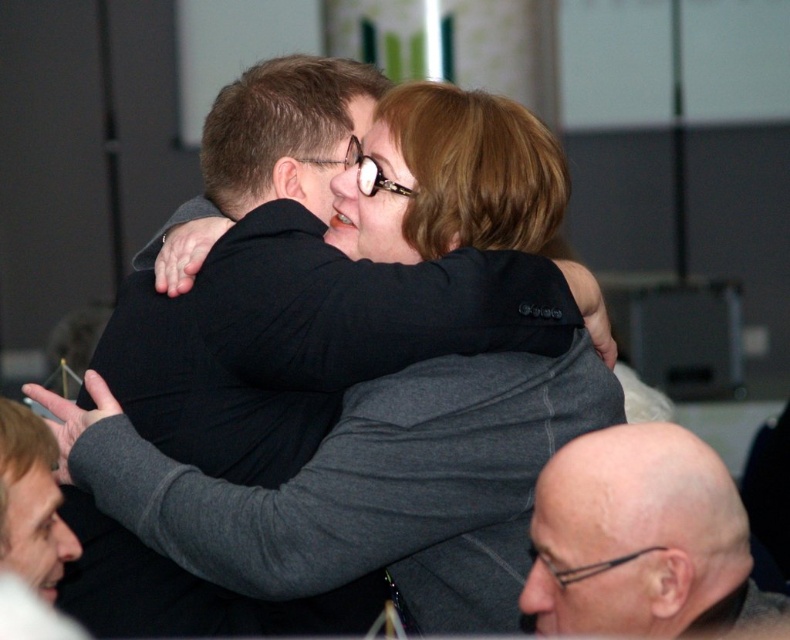
Question: Does bald head at lower right have a greater width compared to gray fabric jacket at center?

Choices:
 (A) yes
 (B) no

Answer: (A)

Question: Is dark gray sweater at center positioned before bald head at lower right?

Choices:
 (A) no
 (B) yes

Answer: (A)

Question: Which point is closer to the camera taking this photo?

Choices:
 (A) (57, 547)
 (B) (239, 378)

Answer: (A)

Question: Which is nearer to the gray fabric jacket at center?

Choices:
 (A) bald head at lower right
 (B) dark gray sweater at center

Answer: (B)

Question: Can you confirm if dark gray sweater at center is positioned to the right of bald head at lower right?

Choices:
 (A) no
 (B) yes

Answer: (A)

Question: Which point is farther from the camera taking this photo?

Choices:
 (A) (510, 388)
 (B) (617, 435)
 (C) (44, 609)

Answer: (A)